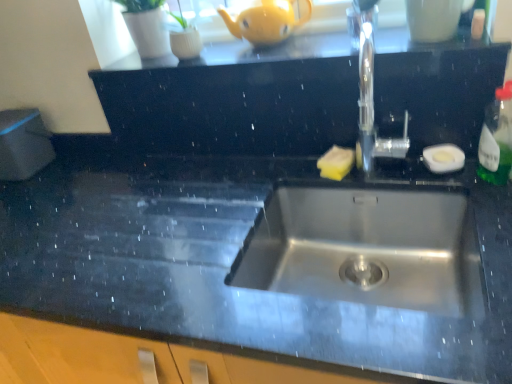
Question: Considering the relative sizes of white glossy mug at upper center and polished stainless steel tap at upper center in the image provided, is white glossy mug at upper center smaller than polished stainless steel tap at upper center?

Choices:
 (A) no
 (B) yes

Answer: (B)

Question: From the image's perspective, would you say white glossy mug at upper center is shown under polished stainless steel tap at upper center?

Choices:
 (A) yes
 (B) no

Answer: (B)

Question: Is white glossy mug at upper center completely or partially outside of polished stainless steel tap at upper center?

Choices:
 (A) yes
 (B) no

Answer: (A)

Question: Does white glossy mug at upper center appear on the left side of polished stainless steel tap at upper center?

Choices:
 (A) yes
 (B) no

Answer: (B)

Question: Does white glossy mug at upper center lie in front of polished stainless steel tap at upper center?

Choices:
 (A) yes
 (B) no

Answer: (B)

Question: Is polished stainless steel tap at upper center spatially inside white glossy mug at upper center, or outside of it?

Choices:
 (A) inside
 (B) outside

Answer: (B)

Question: Does point (382, 145) appear closer or farther from the camera than point (458, 6)?

Choices:
 (A) closer
 (B) farther

Answer: (B)

Question: Is polished stainless steel tap at upper center taller or shorter than white glossy mug at upper center?

Choices:
 (A) short
 (B) tall

Answer: (B)

Question: Relative to white glossy mug at upper center, is polished stainless steel tap at upper center in front or behind?

Choices:
 (A) front
 (B) behind

Answer: (A)

Question: Visually, is polished stainless steel tap at upper center positioned to the left or to the right of yellow matte teapot at upper center?

Choices:
 (A) right
 (B) left

Answer: (A)

Question: Is point (382, 150) positioned closer to the camera than point (274, 39)?

Choices:
 (A) closer
 (B) farther

Answer: (A)

Question: Relative to yellow matte teapot at upper center, is polished stainless steel tap at upper center in front or behind?

Choices:
 (A) front
 (B) behind

Answer: (A)

Question: From a real-world perspective, relative to yellow matte teapot at upper center, is polished stainless steel tap at upper center vertically above or below?

Choices:
 (A) above
 (B) below

Answer: (B)

Question: From the image's perspective, is green translucent bottle at right positioned above or below white glossy mug at upper center?

Choices:
 (A) below
 (B) above

Answer: (A)

Question: From a real-world perspective, is green translucent bottle at right positioned above or below white glossy mug at upper center?

Choices:
 (A) below
 (B) above

Answer: (A)